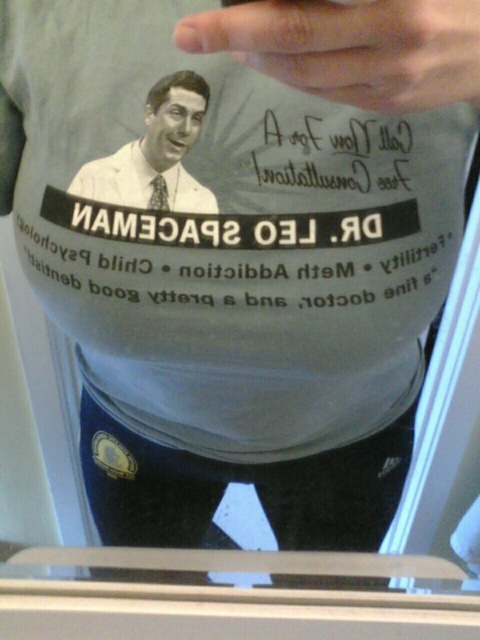
Question: Among these objects, which one is nearest to the camera?

Choices:
 (A) matte white tie at upper left
 (B) white matte t-shirt at center

Answer: (B)

Question: Observing the image, what is the correct spatial positioning of white matte t-shirt at center in reference to matte white tie at upper left?

Choices:
 (A) right
 (B) left

Answer: (A)

Question: Can you confirm if white matte t-shirt at center is bigger than matte white tie at upper left?

Choices:
 (A) yes
 (B) no

Answer: (A)

Question: Is white matte t-shirt at center positioned before matte white tie at upper left?

Choices:
 (A) yes
 (B) no

Answer: (A)